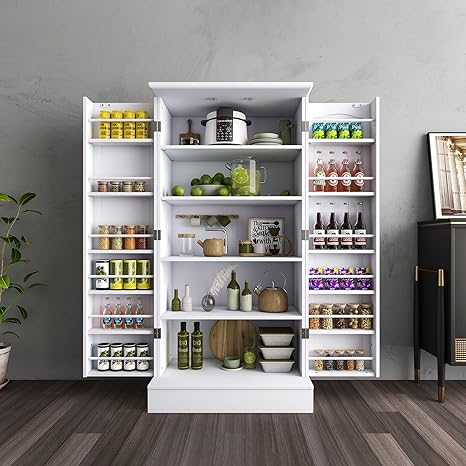
At what (x,y) coordinates should I click in order to perform the action: click on yellow cans on left top shelf. Please return your answer as a coordinate pair (x, y). This screenshot has height=466, width=466. Looking at the image, I should click on (103, 127), (115, 128), (129, 130), (140, 129).